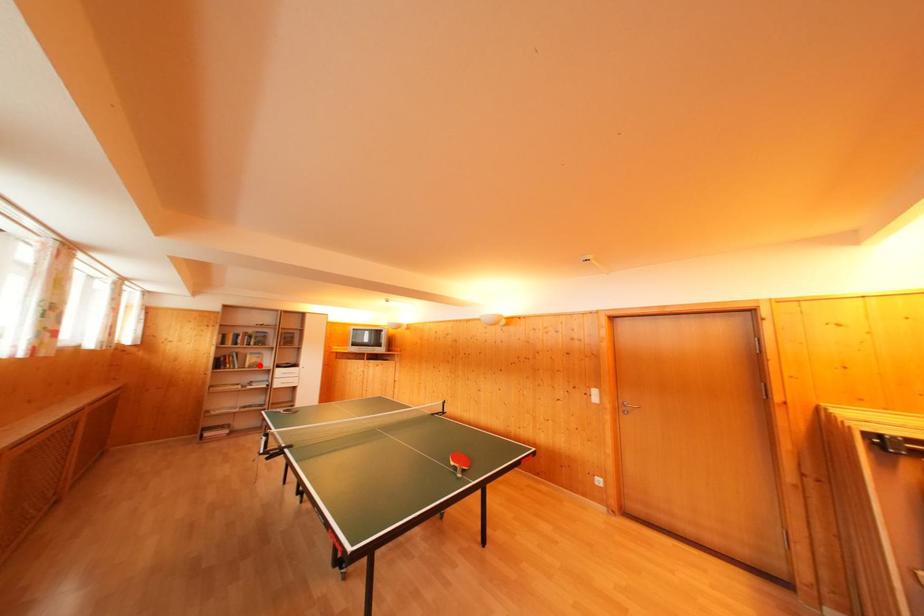
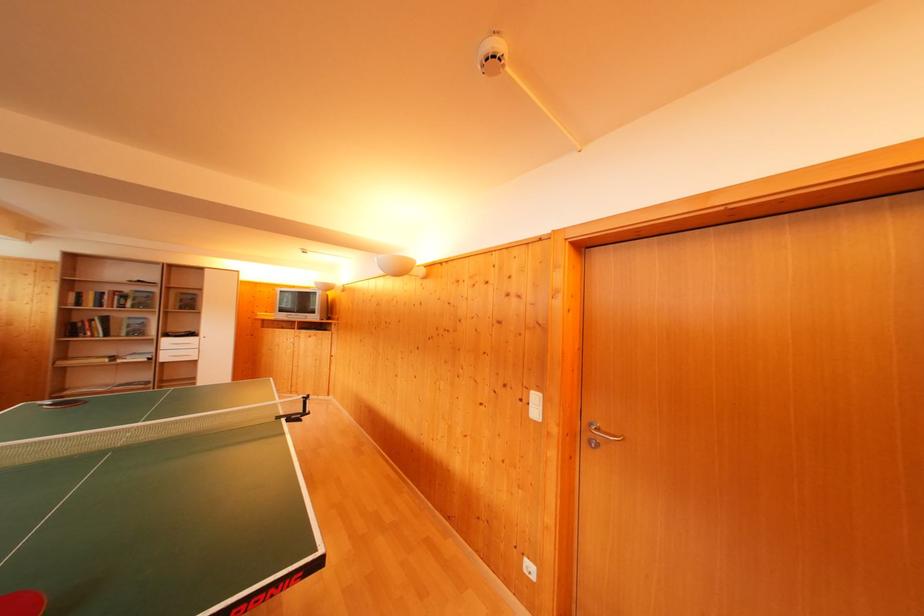
In the second image, find the point that corresponds to the highlighted location in the first image.

(140, 331)